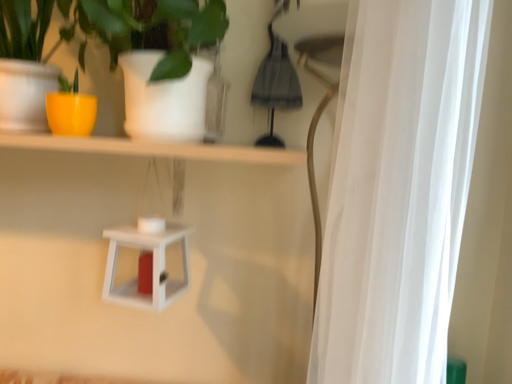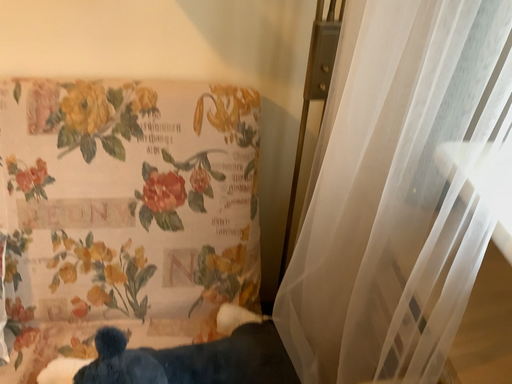
Question: Which way did the camera rotate in the video?

Choices:
 (A) rotated left
 (B) rotated right

Answer: (B)